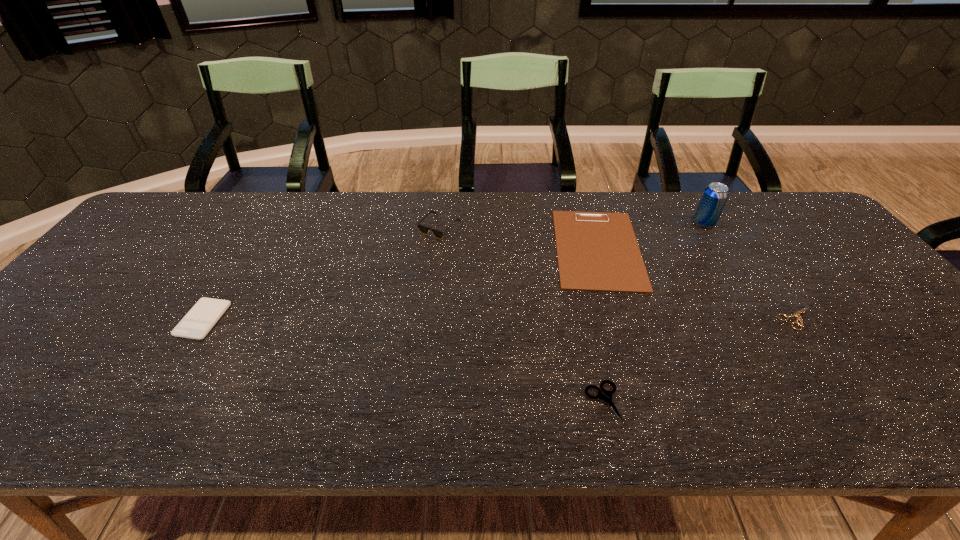
You are a GUI agent. You are given a task and a screenshot of the screen. Output one action in this format:
    pyautogui.click(x=<x>, y=<y>)
    Task: Click on the free space at the near edge
    
    Given the screenshot: What is the action you would take?
    pyautogui.click(x=565, y=399)

Where is `vacant region at the left edge of the desktop`? The image size is (960, 540). vacant region at the left edge of the desktop is located at coordinates (103, 282).

The image size is (960, 540). Identify the location of free space that is in between the clipboard and the calculator. (400, 284).

Locate an element on the screen. The height and width of the screenshot is (540, 960). blank region between the leftmost object and the clipboard is located at coordinates (400, 284).

Locate an element on the screen. The image size is (960, 540). free spot between the fifth object from right to left and the fifth tallest object is located at coordinates (521, 315).

Where is `unoccupied position between the nearest object and the leftmost object`? The width and height of the screenshot is (960, 540). unoccupied position between the nearest object and the leftmost object is located at coordinates (403, 361).

The image size is (960, 540). What are the coordinates of `empty space between the left shears and the clipboard` in the screenshot? It's located at (600, 326).

Identify the location of free spot between the clipboard and the tallest object. The width and height of the screenshot is (960, 540). (651, 235).

At what (x,y) coordinates should I click in order to perform the action: click on empty location between the fifth object from right to left and the clipboard. Please return your answer as a coordinate pair (x, y). Image resolution: width=960 pixels, height=540 pixels. Looking at the image, I should click on (518, 238).

Where is `object that is the fifth closest one to the fifth shortest object`? Image resolution: width=960 pixels, height=540 pixels. object that is the fifth closest one to the fifth shortest object is located at coordinates (797, 314).